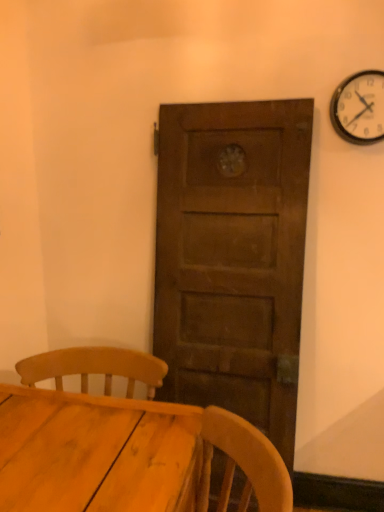
What do you see at coordinates (359, 108) in the screenshot?
I see `metallic silver clock at upper right` at bounding box center [359, 108].

At what (x,y) coordinates should I click in order to perform the action: click on metallic silver clock at upper right. Please return your answer as a coordinate pair (x, y). Looking at the image, I should click on (359, 108).

The image size is (384, 512). Describe the element at coordinates (95, 453) in the screenshot. I see `wooden table at lower left` at that location.

Locate an element on the screen. This screenshot has height=512, width=384. wooden table at lower left is located at coordinates (95, 453).

I want to click on metallic silver clock at upper right, so click(x=359, y=108).

Considering the positions of objects wooden table at lower left and metallic silver clock at upper right in the image provided, who is more to the right, wooden table at lower left or metallic silver clock at upper right?

metallic silver clock at upper right.

Between wooden table at lower left and metallic silver clock at upper right, which one is positioned behind?

metallic silver clock at upper right is further away from the camera.

Considering the points (71, 472) and (380, 139), which point is in front, point (71, 472) or point (380, 139)?

The point (71, 472) is more forward.

From the image's perspective, is wooden table at lower left positioned above or below metallic silver clock at upper right?

wooden table at lower left is below metallic silver clock at upper right.

From a real-world perspective, who is located lower, wooden table at lower left or metallic silver clock at upper right?

wooden table at lower left.

Looking at their sizes, would you say wooden table at lower left is wider or thinner than metallic silver clock at upper right?

In the image, wooden table at lower left appears to be wider than metallic silver clock at upper right.

Considering the relative sizes of wooden table at lower left and metallic silver clock at upper right in the image provided, is wooden table at lower left shorter than metallic silver clock at upper right?

In fact, wooden table at lower left may be taller than metallic silver clock at upper right.

Between wooden table at lower left and metallic silver clock at upper right, which one has larger size?

wooden table at lower left is bigger.

Is wooden table at lower left spatially inside metallic silver clock at upper right, or outside of it?

wooden table at lower left is spatially situated outside metallic silver clock at upper right.

Is wooden table at lower left far from metallic silver clock at upper right?

That's right, there is a large distance between wooden table at lower left and metallic silver clock at upper right.

Is wooden table at lower left facing away from metallic silver clock at upper right?

wooden table at lower left does not have its back to metallic silver clock at upper right.

Identify the location of table that appears below the metallic silver clock at upper right (from the image's perspective). (95, 453).

Is metallic silver clock at upper right to the left or to the right of wooden table at lower left in the image?

Based on their positions, metallic silver clock at upper right is located to the right of wooden table at lower left.

Which is in front, metallic silver clock at upper right or wooden table at lower left?

wooden table at lower left is in front.

Which is further, (342, 89) or (77, 405)?

The point (342, 89) is farther.

From the image's perspective, relative to wooden table at lower left, is metallic silver clock at upper right above or below?

Based on their image positions, metallic silver clock at upper right is located above wooden table at lower left.

From a real-world perspective, which is physically below, metallic silver clock at upper right or wooden table at lower left?

From a 3D spatial view, wooden table at lower left is below.

Considering the relative sizes of metallic silver clock at upper right and wooden table at lower left in the image provided, is metallic silver clock at upper right thinner than wooden table at lower left?

Yes.

Based on the photo, between metallic silver clock at upper right and wooden table at lower left, which one has more height?

wooden table at lower left is taller.

Does metallic silver clock at upper right have a smaller size compared to wooden table at lower left?

Yes.

Is metallic silver clock at upper right not inside wooden table at lower left?

That's correct, metallic silver clock at upper right is outside of wooden table at lower left.

Is the surface of metallic silver clock at upper right in direct contact with wooden table at lower left?

There is a gap between metallic silver clock at upper right and wooden table at lower left.

Is metallic silver clock at upper right oriented towards wooden table at lower left?

No, metallic silver clock at upper right does not turn towards wooden table at lower left.

The height and width of the screenshot is (512, 384). What are the coordinates of `wall clock above the wooden table at lower left (from a real-world perspective)` in the screenshot? It's located at (359, 108).

The image size is (384, 512). Find the location of `wall clock located above the wooden table at lower left (from the image's perspective)`. wall clock located above the wooden table at lower left (from the image's perspective) is located at coordinates (359, 108).

The width and height of the screenshot is (384, 512). Identify the location of table below the metallic silver clock at upper right (from the image's perspective). (95, 453).